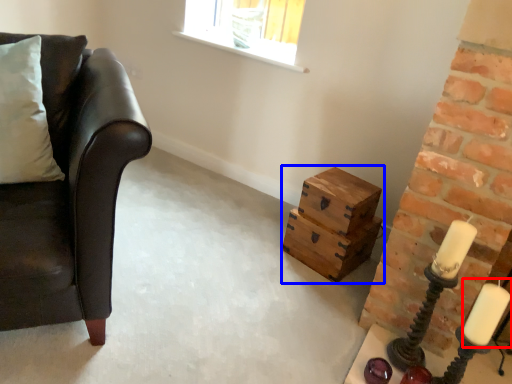
Question: Which object appears farthest to the camera in this image, candle (highlighted by a red box) or crate (highlighted by a blue box)?

Choices:
 (A) candle
 (B) crate

Answer: (B)